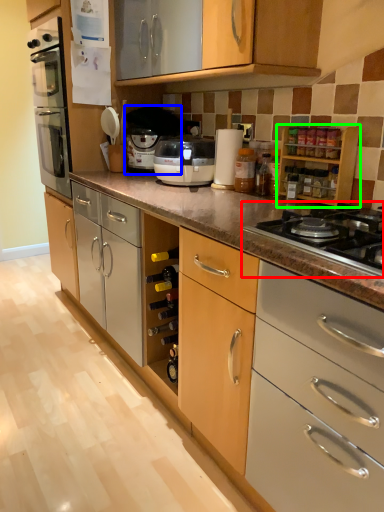
Question: Based on their relative distances, which object is nearer to gas stove (highlighted by a red box)? Choose from coffee machine (highlighted by a blue box) and cabinetry (highlighted by a green box).

Choices:
 (A) coffee machine
 (B) cabinetry

Answer: (B)